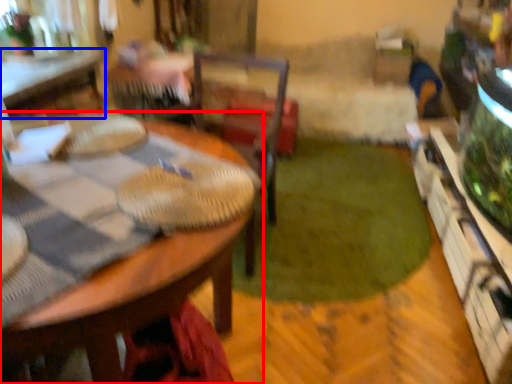
Question: Which point is further to the camera, table (highlighted by a red box) or table (highlighted by a blue box)?

Choices:
 (A) table
 (B) table

Answer: (B)